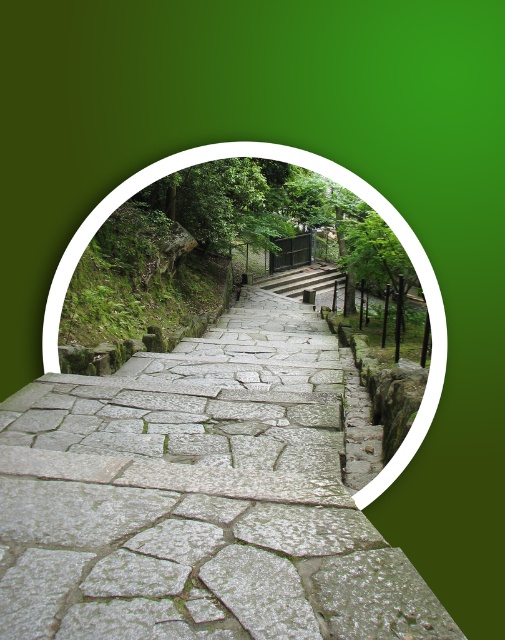
From the picture: You are a delivery person carrying a box and need to walk up the gray stone steps at center and the gray stone stairs at center. The path between them is 1.48 meters wide. Can you safely navigate through the path with your box?

The path between the gray stone steps at center and the gray stone stairs at center is 1.48 meters wide, so yes, you can safely navigate through the path with your box as long as it fits within that width.

From the picture: You are standing at the entrance of the pathway in the image. If you want to reach the gray stone steps at center, which direction should you walk relative to the path?

You should walk upwards along the pathway since the gray stone steps at center are positioned at point [198,497], which is along the upward direction of the path.